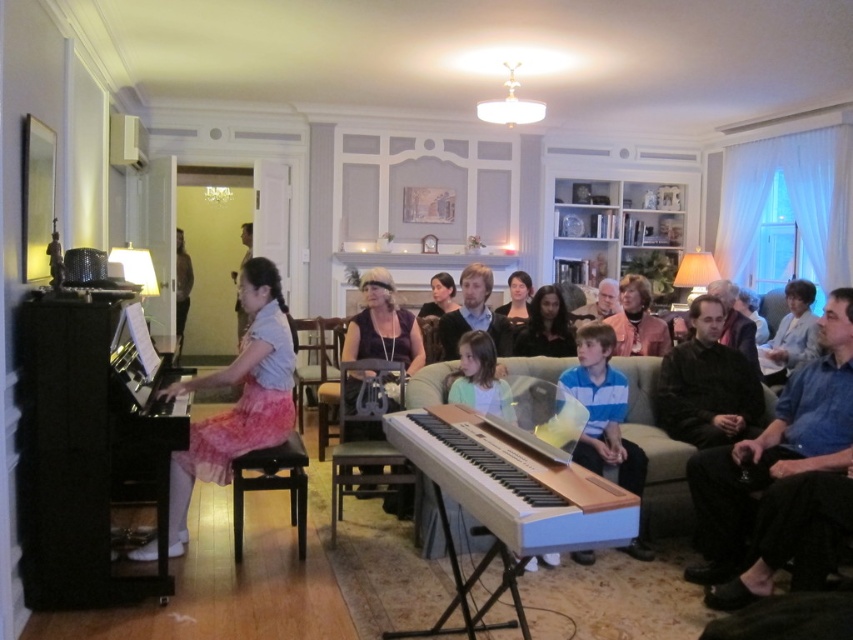
Question: Considering the relative positions of pink satin skirt at center and light blue fabric shirt at right in the image provided, where is pink satin skirt at center located with respect to light blue fabric shirt at right?

Choices:
 (A) left
 (B) right

Answer: (A)

Question: Based on their relative distances, which object is farther from the matte purple blouse at center?

Choices:
 (A) smooth black shirt at center
 (B) pink satin skirt at center
 (C) dark brown leather jacket at left

Answer: (C)

Question: Which object appears closest to the camera in this image?

Choices:
 (A) pink satin skirt at center
 (B) smooth black shirt at center

Answer: (A)

Question: Which of the following is the farthest from the observer?

Choices:
 (A) (238, 342)
 (B) (700, 536)
 (C) (235, 413)

Answer: (A)

Question: Considering the relative positions of dark blue shirt at center and pink fabric skirt at center in the image provided, where is dark blue shirt at center located with respect to pink fabric skirt at center?

Choices:
 (A) right
 (B) left

Answer: (A)

Question: Considering the relative positions of matte purple blouse at center and dark brown leather jacket at left in the image provided, where is matte purple blouse at center located with respect to dark brown leather jacket at left?

Choices:
 (A) right
 (B) left

Answer: (A)